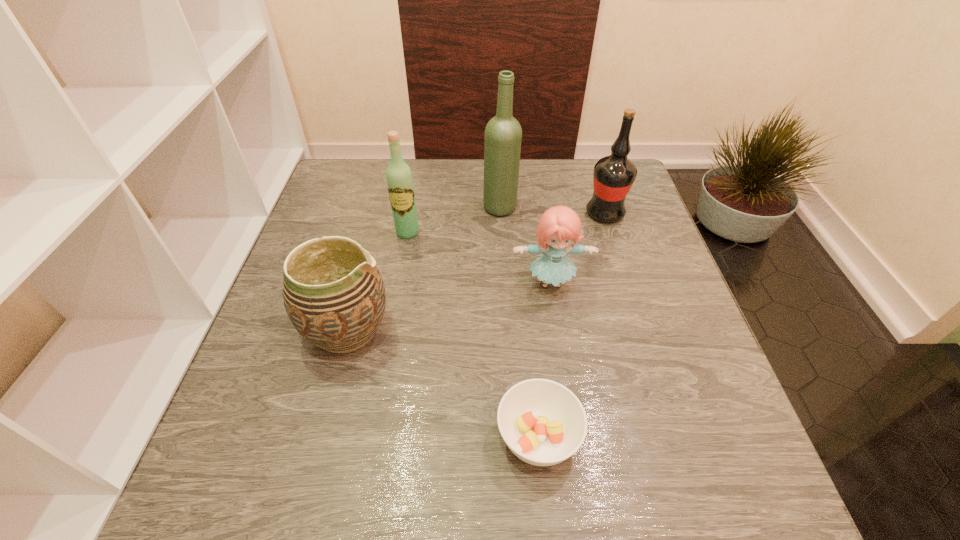
In the image, there is a desktop. At what (x,y) coordinates should I click in order to perform the action: click on vacant area at the left edge. Please return your answer as a coordinate pair (x, y). Looking at the image, I should click on (354, 238).

Image resolution: width=960 pixels, height=540 pixels. I want to click on free spot between the pottery and the tallest object, so click(423, 268).

I want to click on free space between the rightmost object and the leftmost wine bottle, so click(506, 223).

The width and height of the screenshot is (960, 540). Identify the location of free point between the rightmost object and the soup bowl. (571, 326).

Locate an element on the screen. vacant point located between the shortest object and the second wine bottle from left to right is located at coordinates (519, 322).

The width and height of the screenshot is (960, 540). I want to click on blank region between the leftmost wine bottle and the doll, so click(479, 258).

I want to click on free space between the doll and the soup bowl, so pyautogui.click(x=544, y=360).

Locate an element on the screen. The image size is (960, 540). free space that is in between the doll and the tallest wine bottle is located at coordinates (525, 245).

This screenshot has width=960, height=540. I want to click on vacant space that's between the nearest object and the leftmost wine bottle, so click(x=472, y=335).

The width and height of the screenshot is (960, 540). In order to click on the fifth closest object to the pottery in this screenshot , I will do `click(613, 176)`.